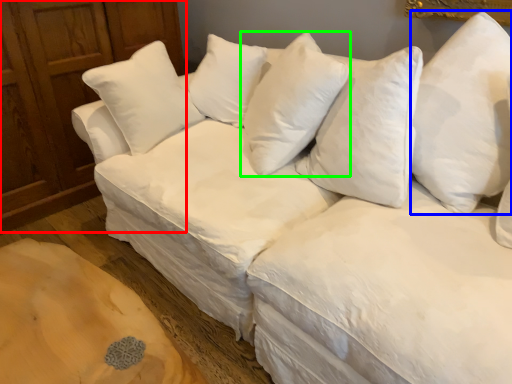
Question: Based on their relative distances, which object is farther from dresser (highlighted by a red box)? Choose from pillow (highlighted by a blue box) and pillow (highlighted by a green box).

Choices:
 (A) pillow
 (B) pillow

Answer: (A)